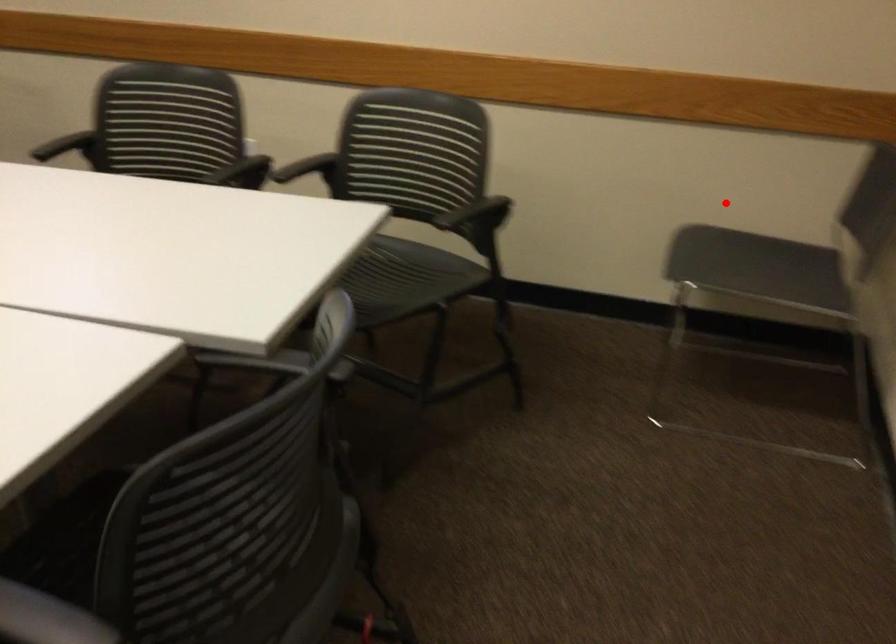
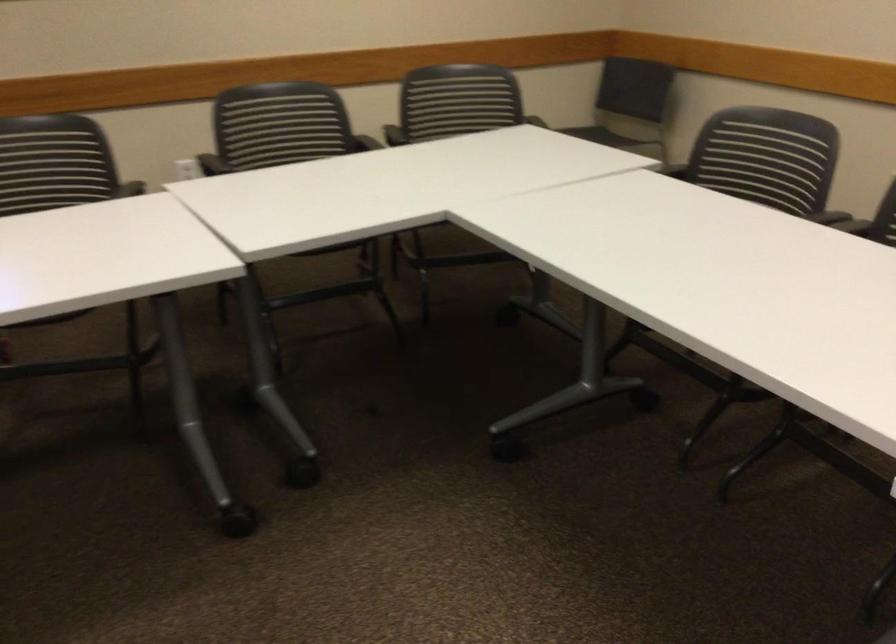
The point at the highlighted location is marked in the first image. Where is the corresponding point in the second image?

(529, 113)